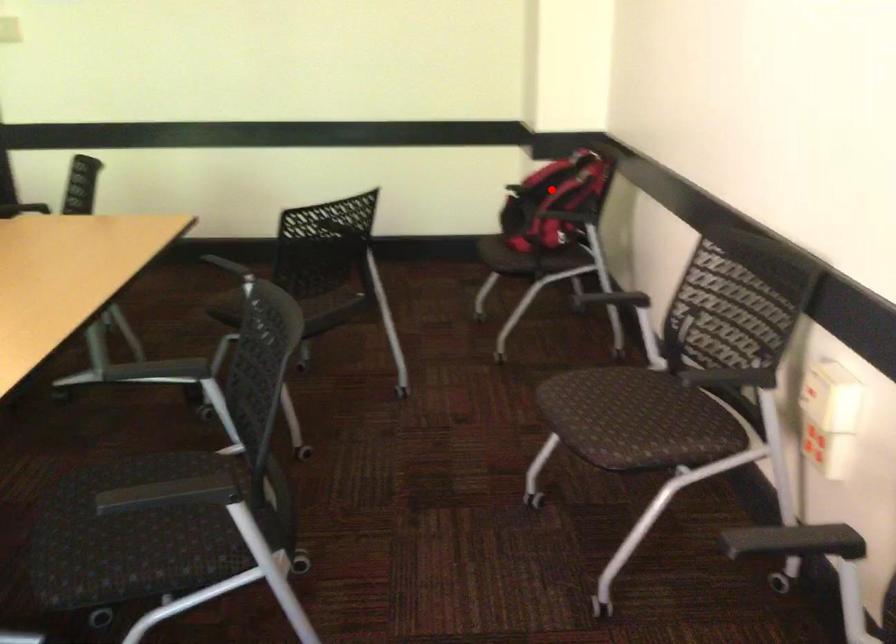
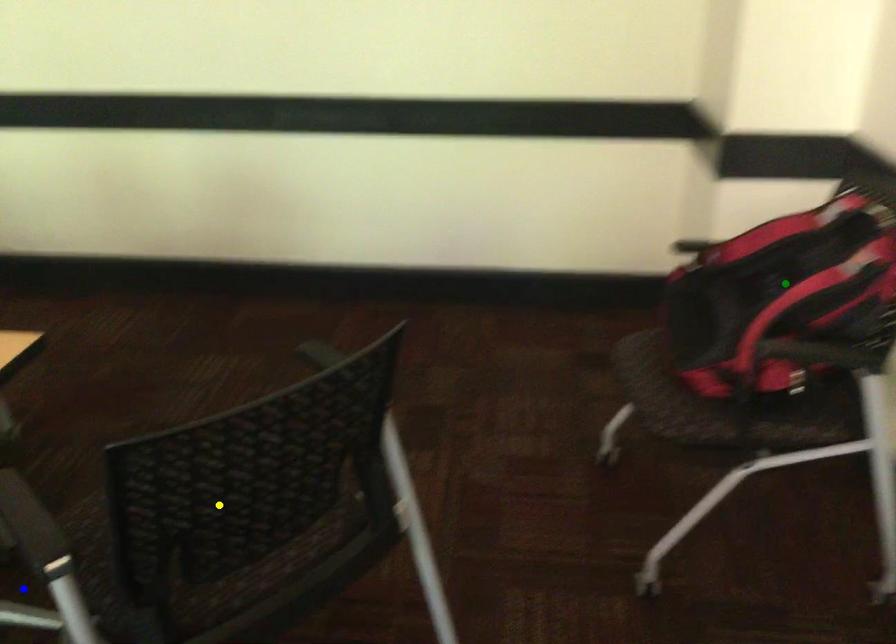
Question: I am providing you with two images of the same scene from different viewpoints. A red point is marked on the first image. You are given multiple points on the second image. Which mark in image 2 goes with the point in image 1?

Choices:
 (A) blue point
 (B) yellow point
 (C) green point

Answer: (C)